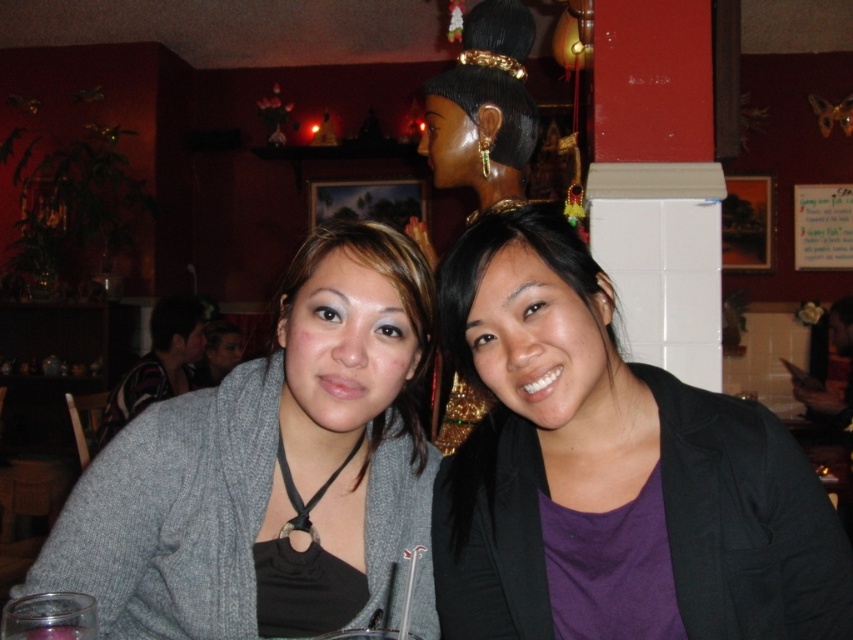
Question: Which of the following is the closest to the observer?

Choices:
 (A) pos(666,627)
 (B) pos(194,490)

Answer: (A)

Question: Which point is closer to the camera?

Choices:
 (A) matte gray cardigan at center
 (B) purple matte/black blazer at center

Answer: (B)

Question: Can you confirm if purple matte/black blazer at center is positioned to the right of matte gray cardigan at center?

Choices:
 (A) yes
 (B) no

Answer: (A)

Question: In this image, where is purple matte/black blazer at center located relative to matte gray cardigan at center?

Choices:
 (A) above
 (B) below

Answer: (A)

Question: Does purple matte/black blazer at center appear over matte gray cardigan at center?

Choices:
 (A) no
 (B) yes

Answer: (B)

Question: Which object appears closest to the camera in this image?

Choices:
 (A) purple matte/black blazer at center
 (B) matte gray cardigan at center

Answer: (A)